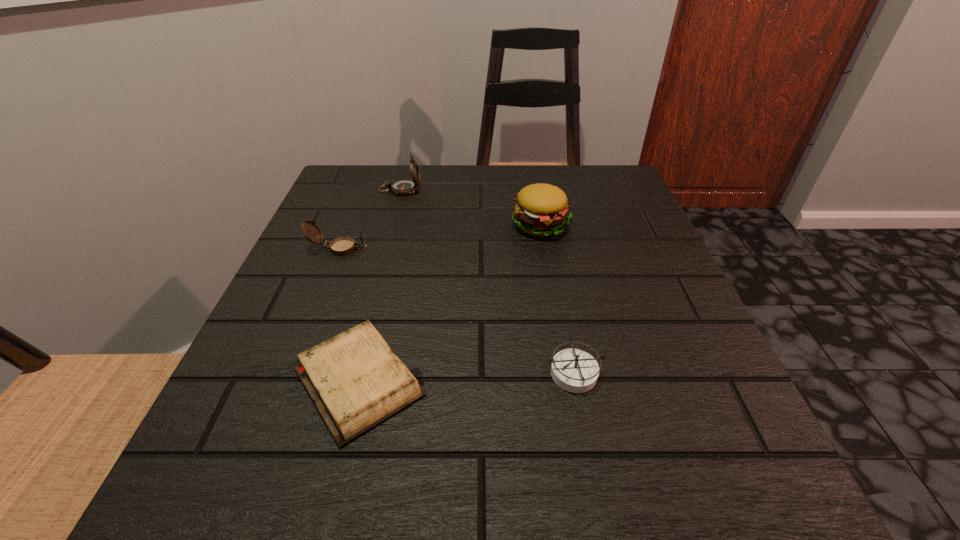
At what (x,y) coordinates should I click in order to perform the action: click on vacant point that satisfies the following two spatial constraints: 1. on the face of the second shortest compass; 2. on the back side of the fourth tallest object. Please return your answer as a coordinate pair (x, y). The width and height of the screenshot is (960, 540). Looking at the image, I should click on (290, 372).

I want to click on vacant space that satisfies the following two spatial constraints: 1. on the face of the tallest compass; 2. on the right side of the diary, so click(x=348, y=381).